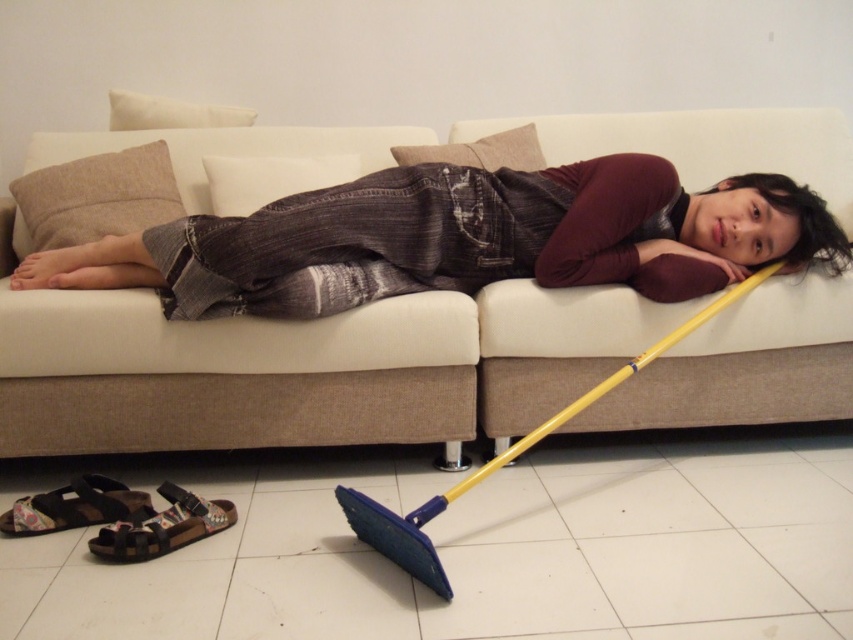
You are arranging a small table between the white fabric couch at center and the denim jeans at center. According to the scene description, where should you place the table so it is between them?

The white fabric couch at center is to the right of the denim jeans at center, so place the table to the left of the white fabric couch at center and to the right of the denim jeans at center to position it between them.

You are standing in the room and see two points marked on the sofa. The first point is at coordinates point [357,136] and the second is at point [734,266]. Which point is closer to you?

Point [357,136] is further to the camera than point [734,266], so the second point is closer to you.

You are a housekeeper entering the room and notice the white fabric couch at center and the denim jeans at center. Which object is closer to the floor?

The white fabric couch at center is positioned under denim jeans at center, so the couch is closer to the floor than the jeans.